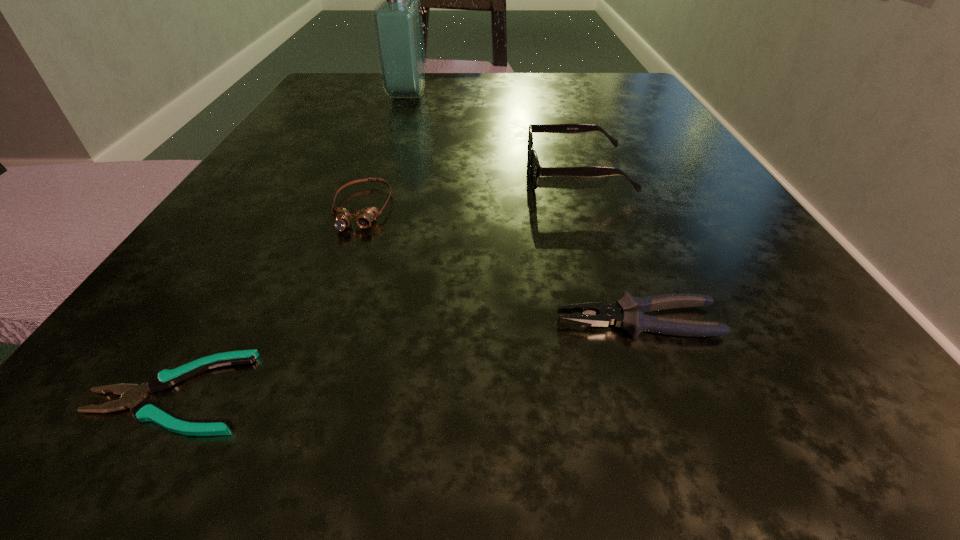
This screenshot has width=960, height=540. In order to click on goggles at the left edge in this screenshot , I will do `click(364, 217)`.

Locate an element on the screen. pliers at the left edge is located at coordinates coord(144,410).

Where is `sunglasses at the right edge`? sunglasses at the right edge is located at coordinates (536, 170).

The image size is (960, 540). I want to click on pliers that is at the right edge, so click(x=628, y=312).

Identify the location of object that is at the far left corner. (397, 20).

The width and height of the screenshot is (960, 540). Find the location of `object situated at the near left corner`. object situated at the near left corner is located at coordinates (144, 410).

You are a GUI agent. You are given a task and a screenshot of the screen. Output one action in this format:
    pyautogui.click(x=<x>, y=<y>)
    Task: Click on the free region at the far edge of the desktop
    The image size is (960, 540).
    Given the screenshot: What is the action you would take?
    pyautogui.click(x=516, y=78)

This screenshot has height=540, width=960. What are the coordinates of `free space at the left edge` in the screenshot? It's located at (204, 261).

Where is `vacant space at the right edge`? This screenshot has width=960, height=540. vacant space at the right edge is located at coordinates pos(659,127).

At what (x,y) coordinates should I click in order to perform the action: click on vacant space at the far left corner of the desktop. Please return your answer as a coordinate pair (x, y). The height and width of the screenshot is (540, 960). Looking at the image, I should click on (322, 119).